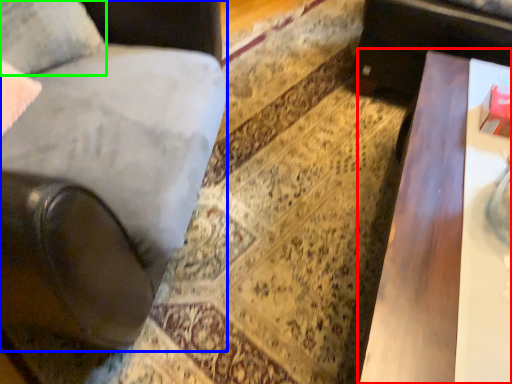
Question: Which object is the closest to the table (highlighted by a red box)? Choose among these: chair (highlighted by a blue box) or pillow (highlighted by a green box).

Choices:
 (A) chair
 (B) pillow

Answer: (A)